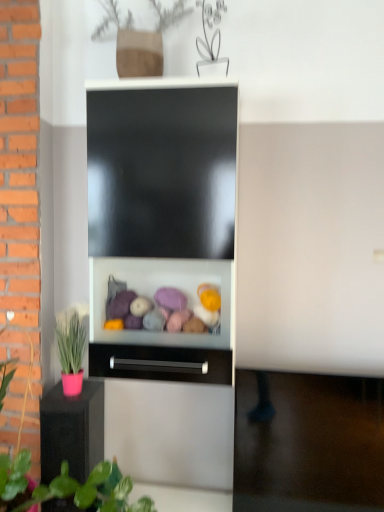
Question: Would you consider black matte drawer at center to be distant from pink matte pot at lower left?

Choices:
 (A) yes
 (B) no

Answer: (B)

Question: Is black matte drawer at center further to the viewer compared to pink matte pot at lower left?

Choices:
 (A) no
 (B) yes

Answer: (A)

Question: Does black matte drawer at center have a greater width compared to pink matte pot at lower left?

Choices:
 (A) no
 (B) yes

Answer: (A)

Question: Can you confirm if black matte drawer at center is bigger than pink matte pot at lower left?

Choices:
 (A) yes
 (B) no

Answer: (B)

Question: Is pink matte pot at lower left at the back of black matte drawer at center?

Choices:
 (A) yes
 (B) no

Answer: (B)

Question: Is black matte drawer at center completely or partially outside of pink matte pot at lower left?

Choices:
 (A) no
 (B) yes

Answer: (B)

Question: Considering the relative sizes of pink matte pot at left and pink matte pot at lower left in the image provided, is pink matte pot at left thinner than pink matte pot at lower left?

Choices:
 (A) yes
 (B) no

Answer: (B)

Question: Is pink matte pot at left bigger than pink matte pot at lower left?

Choices:
 (A) no
 (B) yes

Answer: (B)

Question: Is pink matte pot at left smaller than pink matte pot at lower left?

Choices:
 (A) no
 (B) yes

Answer: (A)

Question: Is pink matte pot at left oriented away from pink matte pot at lower left?

Choices:
 (A) no
 (B) yes

Answer: (B)

Question: Is pink matte pot at left to the left of pink matte pot at lower left from the viewer's perspective?

Choices:
 (A) no
 (B) yes

Answer: (A)

Question: Is pink matte pot at left at the right side of pink matte pot at lower left?

Choices:
 (A) no
 (B) yes

Answer: (B)

Question: Is pink matte pot at left facing away from black matte drawer at center?

Choices:
 (A) yes
 (B) no

Answer: (A)